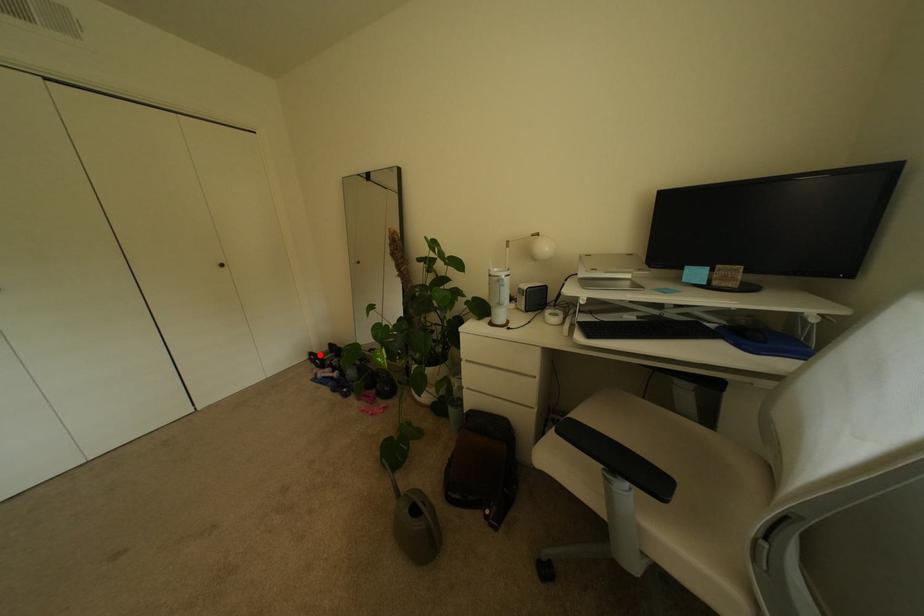
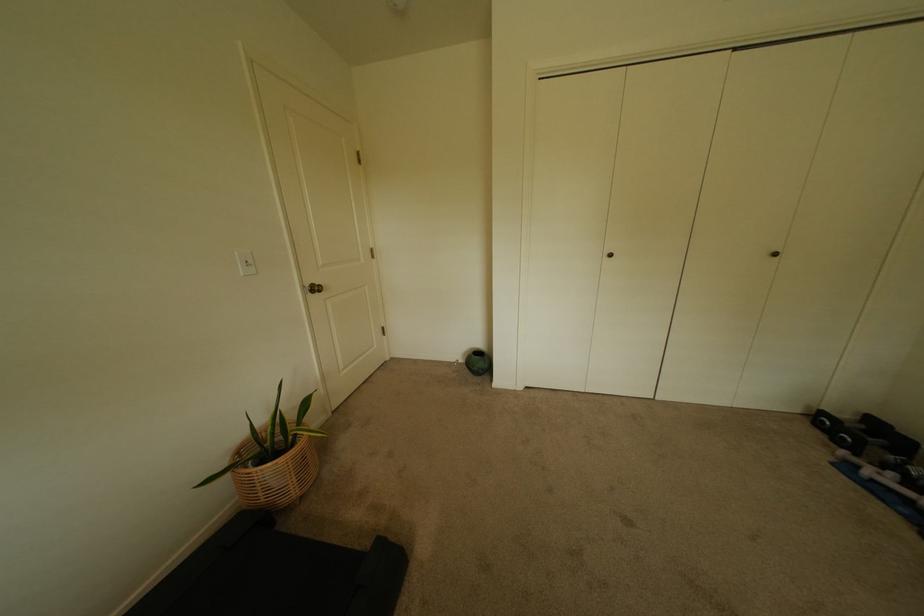
Question: A red point is marked in image1. In image2, is the corresponding 3D point closer to the camera or farther? Reply with the corresponding letter.

Choices:
 (A) The corresponding 3D point is closer.
 (B) The corresponding 3D point is farther.

Answer: (A)